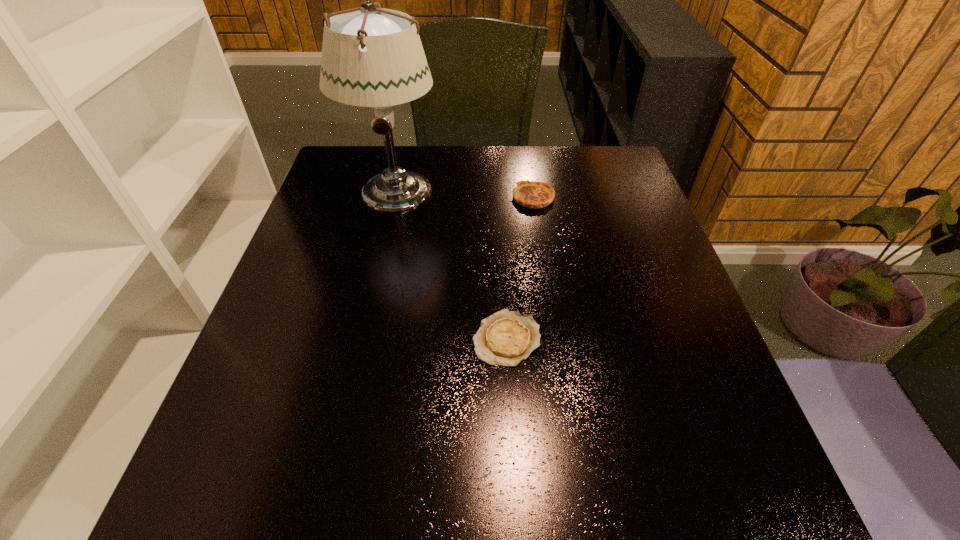
Where is `free space between the shorter quiche and the leftmost object`? free space between the shorter quiche and the leftmost object is located at coordinates (450, 265).

Where is `free spot between the nearest object and the lampshade`? The height and width of the screenshot is (540, 960). free spot between the nearest object and the lampshade is located at coordinates (450, 265).

This screenshot has width=960, height=540. What are the coordinates of `blank region between the farther quiche and the leftmost object` in the screenshot? It's located at (464, 194).

I want to click on vacant region between the tallest object and the taller quiche, so pyautogui.click(x=464, y=194).

Identify the location of empty space between the lampshade and the shortest object. The width and height of the screenshot is (960, 540). (450, 265).

Where is `unoccupied area between the nearer quiche and the farther quiche`? The height and width of the screenshot is (540, 960). unoccupied area between the nearer quiche and the farther quiche is located at coordinates (520, 268).

Find the location of a particular element. free space between the shortest object and the tallest object is located at coordinates (450, 265).

I want to click on free space between the tallest object and the second tallest object, so tap(464, 194).

Locate which object is the second closest to the second tallest object. Please provide its 2D coordinates. Your answer should be formatted as a tuple, i.e. [(x, y)], where the tuple contains the x and y coordinates of a point satisfying the conditions above.

[(506, 338)]

Identify the location of object that is the closest to the shortest object. (372, 57).